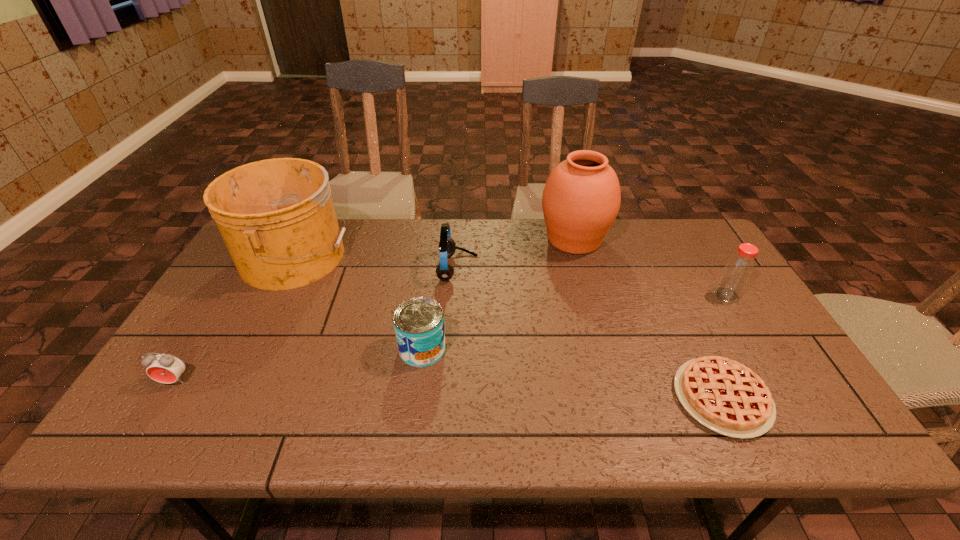
Identify the location of free space between the urn and the bucket. This screenshot has width=960, height=540. (434, 248).

At what (x,y) coordinates should I click in order to perform the action: click on free space between the headset and the fifth object from left to right. Please return your answer as a coordinate pair (x, y). This screenshot has height=540, width=960. Looking at the image, I should click on (516, 254).

The width and height of the screenshot is (960, 540). I want to click on free spot between the headset and the bottle, so click(592, 281).

Find the location of `free space between the fifth object from left to right and the headset`. free space between the fifth object from left to right and the headset is located at coordinates (516, 254).

Where is `free space between the bottle and the fifth object from left to right`? The image size is (960, 540). free space between the bottle and the fifth object from left to right is located at coordinates (650, 267).

Where is `free point between the bucket and the headset`? This screenshot has width=960, height=540. free point between the bucket and the headset is located at coordinates (375, 262).

The height and width of the screenshot is (540, 960). In order to click on free area in between the pie and the can in this screenshot , I will do `click(572, 373)`.

This screenshot has width=960, height=540. I want to click on free space between the bucket and the bottle, so click(510, 275).

Where is `empty location between the can and the rightmost object`? The width and height of the screenshot is (960, 540). empty location between the can and the rightmost object is located at coordinates (574, 322).

Choose which object is the sixth nearest neighbor to the alarm clock. Please provide its 2D coordinates. Your answer should be formatted as a tuple, i.e. [(x, y)], where the tuple contains the x and y coordinates of a point satisfying the conditions above.

[(738, 270)]